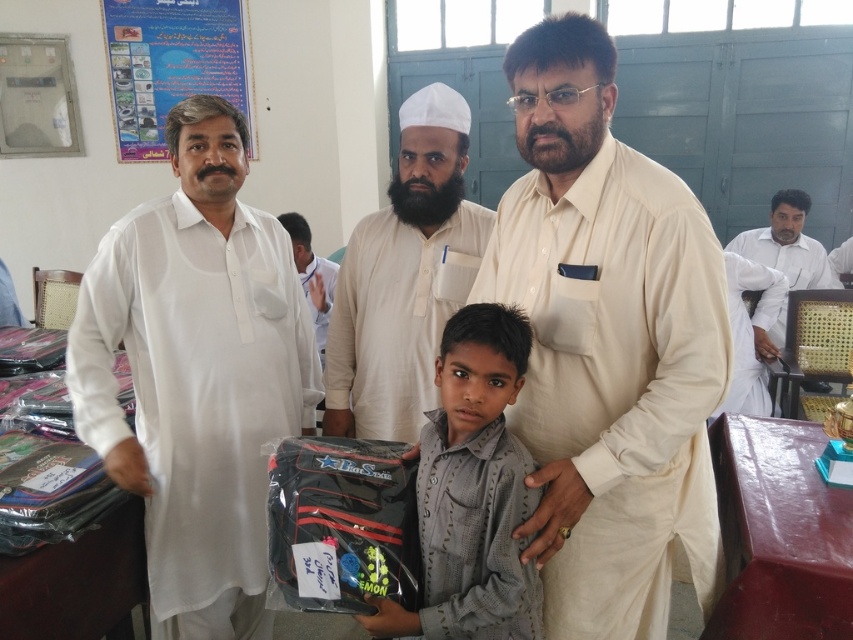
Question: Can you confirm if white cotton shirt at left is smaller than blue paper poster at upper left?

Choices:
 (A) no
 (B) yes

Answer: (A)

Question: Which object is positioned closest to the blue paper poster at upper left?

Choices:
 (A) light beige cotton shirt at center
 (B) white cotton shirt at left
 (C) gray cotton shirt at center
 (D) white cotton shirt at center

Answer: (B)

Question: Which point appears farthest from the camera in this image?

Choices:
 (A) (190, 202)
 (B) (807, 240)

Answer: (B)

Question: Can you confirm if light beige cotton shirt at center is wider than gray cotton shirt at center?

Choices:
 (A) yes
 (B) no

Answer: (A)

Question: Which of the following is the closest to the observer?

Choices:
 (A) (421, 129)
 (B) (810, 248)
 (C) (177, 86)
 (D) (711, 410)

Answer: (D)

Question: Does white cotton shirt at left have a smaller size compared to blue paper poster at upper left?

Choices:
 (A) yes
 (B) no

Answer: (B)